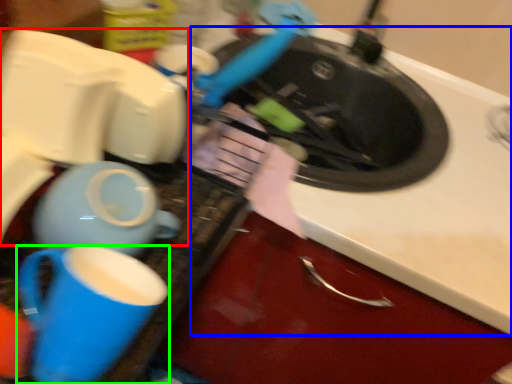
Question: Which object is the closest to the appliance (highlighted by a red box)? Choose among these: counter top (highlighted by a blue box) or coffee cup (highlighted by a green box).

Choices:
 (A) counter top
 (B) coffee cup

Answer: (B)